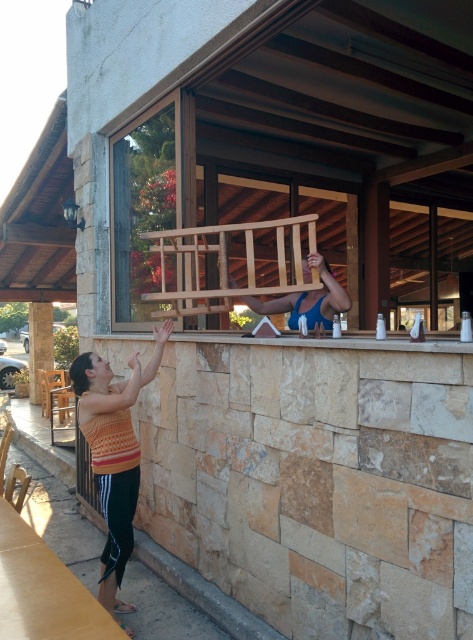
Question: Does blue fabric at center appear on the right side of brown stone pillar at lower left?

Choices:
 (A) no
 (B) yes

Answer: (B)

Question: Considering the real-world distances, which object is farthest from the wooden rail at center?

Choices:
 (A) orange striped tank top at lower left
 (B) blue fabric at center
 (C) brown stone pillar at lower left

Answer: (C)

Question: Which point appears closest to the camera in this image?

Choices:
 (A) (324, 324)
 (B) (121, 547)
 (C) (44, 356)

Answer: (B)

Question: Which of the following is the closest to the observer?

Choices:
 (A) brown stone pillar at lower left
 (B) orange striped tank top at lower left
 (C) blue fabric at center
 (D) wooden rail at center

Answer: (D)

Question: Can you confirm if wooden rail at center is positioned to the right of brown stone pillar at lower left?

Choices:
 (A) no
 (B) yes

Answer: (B)

Question: Is blue fabric at center to the left of brown stone pillar at lower left from the viewer's perspective?

Choices:
 (A) no
 (B) yes

Answer: (A)